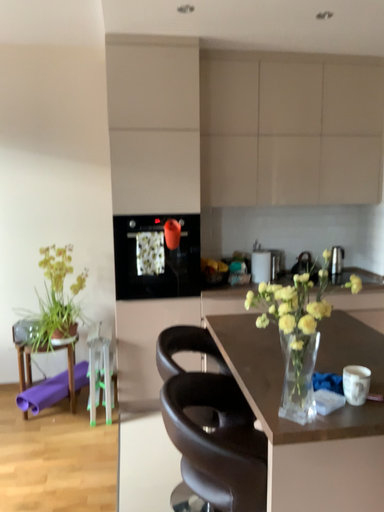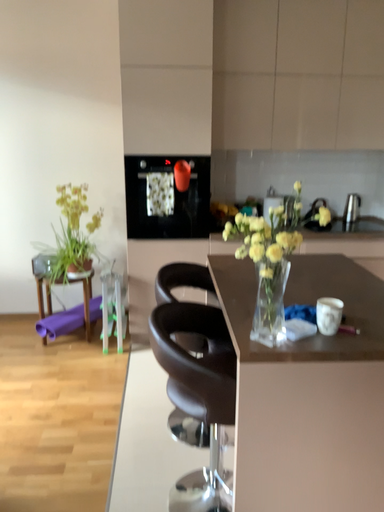
Question: Which way did the camera rotate in the video?

Choices:
 (A) rotated downward
 (B) rotated upward

Answer: (A)